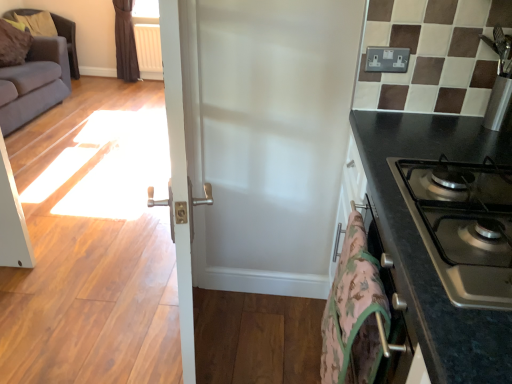
The image size is (512, 384). I want to click on free space above white plastic radiator at upper left (from a real-world perspective), so click(144, 27).